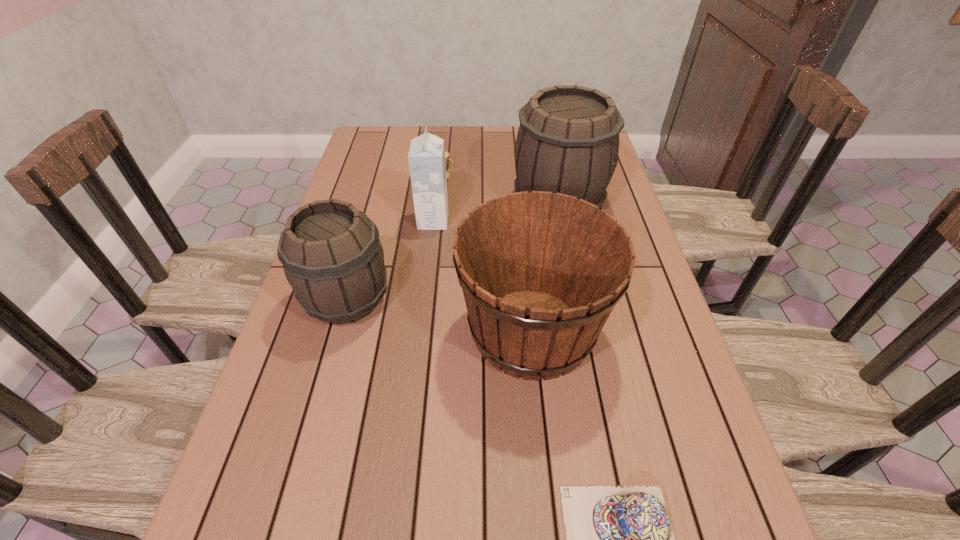
The image size is (960, 540). I want to click on vacant space at the left edge of the desktop, so click(330, 372).

Find the location of a particular element. vacant space at the right edge of the desktop is located at coordinates (658, 312).

Where is `free area in between the leftmost object and the candle`? This screenshot has height=540, width=960. free area in between the leftmost object and the candle is located at coordinates (396, 238).

Find the location of a particular element. The height and width of the screenshot is (540, 960). free space that is in between the farthest wine bucket and the candle is located at coordinates (501, 189).

Image resolution: width=960 pixels, height=540 pixels. I want to click on empty space that is in between the carton and the leftmost wine bucket, so click(391, 260).

Where is `unoccupied area between the tallest wine bucket and the leftmost object`? The height and width of the screenshot is (540, 960). unoccupied area between the tallest wine bucket and the leftmost object is located at coordinates (453, 252).

Identify which object is the nearest to the farthest wine bucket. Please provide its 2D coordinates. Your answer should be formatted as a tuple, i.e. [(x, y)], where the tuple contains the x and y coordinates of a point satisfying the conditions above.

[(541, 273)]

You are a GUI agent. You are given a task and a screenshot of the screen. Output one action in this format:
    pyautogui.click(x=<x>, y=<y>)
    Task: Click on the closest object to the tallest wine bucket
    The height and width of the screenshot is (540, 960).
    Given the screenshot: What is the action you would take?
    pyautogui.click(x=541, y=273)

This screenshot has width=960, height=540. What are the coordinates of `wine bucket that stands as the closest to the leftmost wine bucket` in the screenshot? It's located at (541, 273).

This screenshot has width=960, height=540. Find the location of `the third closest wine bucket to the carton`. the third closest wine bucket to the carton is located at coordinates (568, 140).